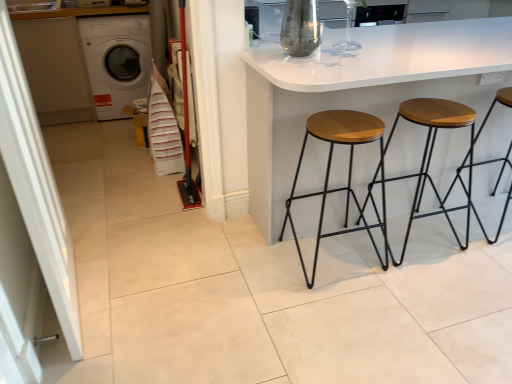
The height and width of the screenshot is (384, 512). Identify the location of free space between woodenmaterial/texturestool at center, marked as the 3th stool in a right-to-left arrangement, and wooden/metallic stool at center, marked as the second stool in a right-to-left arrangement. (381, 249).